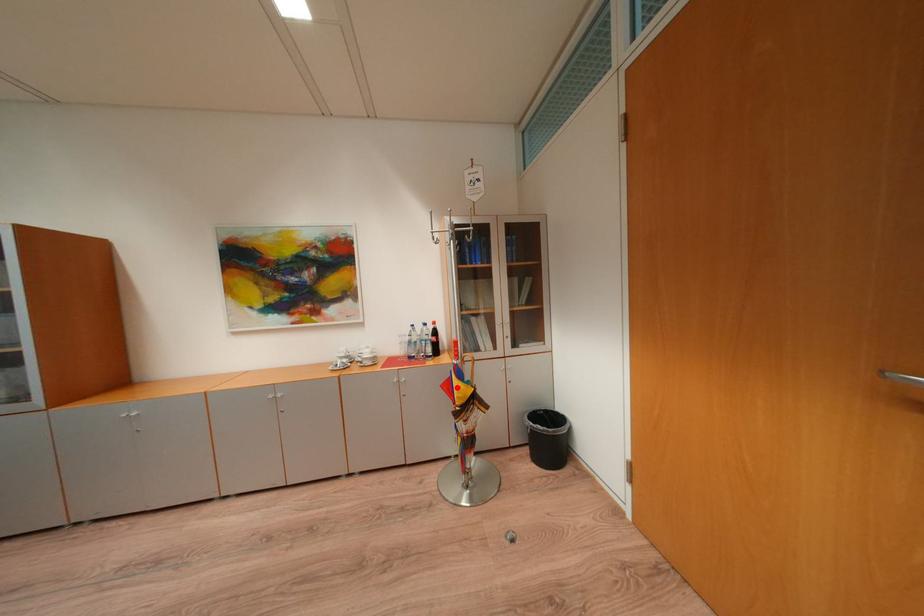
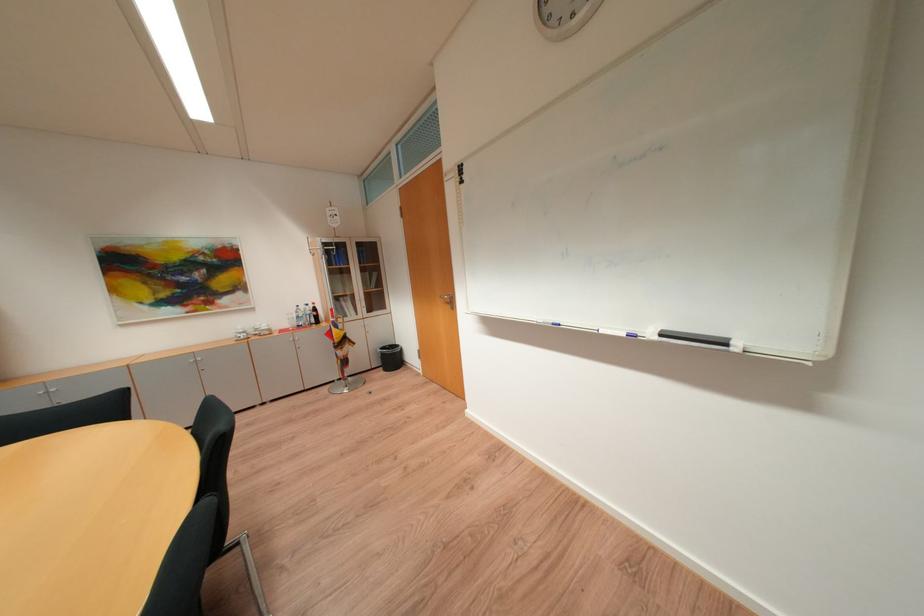
Question: I am providing you with two images of the same scene from different viewpoints. In image1, a red point is highlighted. Considering the same 3D point in image2, which of the following is correct?

Choices:
 (A) It is closer
 (B) It is farther

Answer: (A)